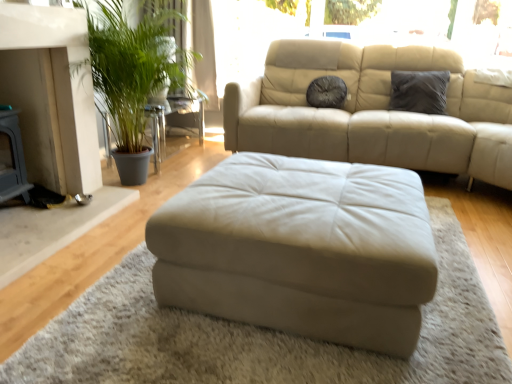
This screenshot has width=512, height=384. What do you see at coordinates (419, 91) in the screenshot? I see `dark gray fabric pillow at upper right, the first pillow from the right` at bounding box center [419, 91].

Identify the location of beige leather ottoman at center. (300, 249).

Which of these two, dark gray fabric pillow at upper right, the first pillow from the right, or dark gray textured pillow at center, the 2th pillow when ordered from right to left, is thinner?

Thinner between the two is dark gray fabric pillow at upper right, the first pillow from the right.

Is dark gray fabric pillow at upper right, the first pillow from the right, placed right next to dark gray textured pillow at center, the first pillow positioned from the left?

No, dark gray fabric pillow at upper right, the first pillow from the right, is not making contact with dark gray textured pillow at center, the first pillow positioned from the left.

Which is in front, dark gray fabric pillow at upper right, the first pillow from the right, or dark gray textured pillow at center, the first pillow positioned from the left?

dark gray fabric pillow at upper right, the first pillow from the right, is more forward.

Is dark gray fabric pillow at upper right, which is counted as the second pillow, starting from the left, at the left side of dark gray textured pillow at center, the first pillow positioned from the left?

Incorrect, dark gray fabric pillow at upper right, which is counted as the second pillow, starting from the left, is not on the left side of dark gray textured pillow at center, the first pillow positioned from the left.

Is green leafy plant at left oriented towards dark gray fabric pillow at upper right, the first pillow from the right?

Yes.

Is green leafy plant at left next to dark gray fabric pillow at upper right, the first pillow from the right, and touching it?

green leafy plant at left and dark gray fabric pillow at upper right, the first pillow from the right, are clearly separated.

Relative to dark gray fabric pillow at upper right, the first pillow from the right, is green leafy plant at left in front or behind?

green leafy plant at left is behind dark gray fabric pillow at upper right, the first pillow from the right.

From the image's perspective, is dark gray textured pillow at center, the 2th pillow when ordered from right to left, located above or below dark gray fabric pillow at upper right, which is counted as the second pillow, starting from the left?

From the image's perspective, dark gray textured pillow at center, the 2th pillow when ordered from right to left, appears above dark gray fabric pillow at upper right, which is counted as the second pillow, starting from the left.

Does dark gray textured pillow at center, the 2th pillow when ordered from right to left, lie in front of dark gray fabric pillow at upper right, the first pillow from the right?

No, it is behind dark gray fabric pillow at upper right, the first pillow from the right.

Is dark gray textured pillow at center, the 2th pillow when ordered from right to left, situated inside dark gray fabric pillow at upper right, which is counted as the second pillow, starting from the left, or outside?

dark gray textured pillow at center, the 2th pillow when ordered from right to left, is not enclosed by dark gray fabric pillow at upper right, which is counted as the second pillow, starting from the left.

Locate an element on the screen. This screenshot has height=384, width=512. pillow on the left of dark gray fabric pillow at upper right, the first pillow from the right is located at coordinates (326, 92).

Does dark gray textured pillow at center, the first pillow positioned from the left, contain beige leather ottoman at center?

No, beige leather ottoman at center is not a part of dark gray textured pillow at center, the first pillow positioned from the left.

From the image's perspective, is dark gray textured pillow at center, the 2th pillow when ordered from right to left, above or below beige leather ottoman at center?

Clearly, from the image's perspective, dark gray textured pillow at center, the 2th pillow when ordered from right to left, is above beige leather ottoman at center.

Who is smaller, dark gray textured pillow at center, the 2th pillow when ordered from right to left, or beige leather ottoman at center?

dark gray textured pillow at center, the 2th pillow when ordered from right to left.

Is dark gray textured pillow at center, the 2th pillow when ordered from right to left, positioned with its back to beige leather ottoman at center?

No, dark gray textured pillow at center, the 2th pillow when ordered from right to left,'s orientation is not away from beige leather ottoman at center.

Does green leafy plant at left come behind beige fabric ottoman at center?

Yes, it is behind beige fabric ottoman at center.

Consider the image. How many degrees apart are the facing directions of green leafy plant at left and beige fabric ottoman at center?

91.3 degrees separate the facing orientations of green leafy plant at left and beige fabric ottoman at center.

Considering the sizes of objects green leafy plant at left and beige fabric ottoman at center in the image provided, who is smaller, green leafy plant at left or beige fabric ottoman at center?

beige fabric ottoman at center.

From the image's perspective, which is below, green leafy plant at left or beige fabric ottoman at center?

beige fabric ottoman at center, from the image's perspective.

You are a GUI agent. You are given a task and a screenshot of the screen. Output one action in this format:
    pyautogui.click(x=<x>, y=<y>)
    Task: Click on the table that is above the beige leather ottoman at center (from the image's perspective)
    This screenshot has height=384, width=512.
    Given the screenshot: What is the action you would take?
    pyautogui.click(x=172, y=123)

Is green leafy plant at left with beige leather ottoman at center?

No.

Is beige leather ottoman at center at the back of green leafy plant at left?

No, green leafy plant at left is not facing the opposite direction of beige leather ottoman at center.

Considering the sizes of dark gray fabric pillow at upper right, the first pillow from the right, and beige fabric ottoman at center in the image, is dark gray fabric pillow at upper right, the first pillow from the right, wider or thinner than beige fabric ottoman at center?

Considering their sizes, dark gray fabric pillow at upper right, the first pillow from the right, looks slimmer than beige fabric ottoman at center.

From the image's perspective, which object appears higher, dark gray fabric pillow at upper right, the first pillow from the right, or beige fabric ottoman at center?

dark gray fabric pillow at upper right, the first pillow from the right, from the image's perspective.

Is beige fabric ottoman at center a part of dark gray fabric pillow at upper right, which is counted as the second pillow, starting from the left?

Definitely not — beige fabric ottoman at center is not inside dark gray fabric pillow at upper right, which is counted as the second pillow, starting from the left.

I want to click on mat in front of the dark gray fabric pillow at upper right, which is counted as the second pillow, starting from the left, so click(x=259, y=336).

You are a GUI agent. You are given a task and a screenshot of the screen. Output one action in this format:
    pyautogui.click(x=<x>, y=<y>)
    Task: Click on the pillow that is below the dark gray textured pillow at center, the first pillow positioned from the left (from the image's perspective)
    The image size is (512, 384).
    Given the screenshot: What is the action you would take?
    (419, 91)

Find the location of a particular element. table located on the left of dark gray fabric pillow at upper right, the first pillow from the right is located at coordinates (172, 123).

Which object lies nearer to the anchor point dark gray fabric pillow at upper right, the first pillow from the right, beige leather ottoman at center or dark gray textured pillow at center, the 2th pillow when ordered from right to left?

Based on the image, dark gray textured pillow at center, the 2th pillow when ordered from right to left, appears to be nearer to dark gray fabric pillow at upper right, the first pillow from the right.

In the scene shown: Considering their positions, is beige fabric ottoman at center positioned closer to dark gray fabric pillow at upper right, which is counted as the second pillow, starting from the left, than dark gray textured pillow at center, the 2th pillow when ordered from right to left?

dark gray textured pillow at center, the 2th pillow when ordered from right to left.

When comparing their distances from dark gray fabric pillow at upper right, the first pillow from the right, does green leafy plant at left or beige leather ottoman at center seem closer?

green leafy plant at left.

Which object lies nearer to the anchor point green leafy plant at left, beige leather ottoman at center or beige fabric ottoman at center?

beige leather ottoman at center.

Based on their spatial positions, is dark gray fabric pillow at upper right, which is counted as the second pillow, starting from the left, or beige fabric ottoman at center closer to dark gray textured pillow at center, the first pillow positioned from the left?

dark gray fabric pillow at upper right, which is counted as the second pillow, starting from the left, is positioned closer to the anchor dark gray textured pillow at center, the first pillow positioned from the left.

Looking at the image, which one is located closer to dark gray fabric pillow at upper right, which is counted as the second pillow, starting from the left, dark gray textured pillow at center, the first pillow positioned from the left, or beige leather ottoman at center?

The object closer to dark gray fabric pillow at upper right, which is counted as the second pillow, starting from the left, is dark gray textured pillow at center, the first pillow positioned from the left.

Estimate the real-world distances between objects in this image. Which object is further from beige fabric ottoman at center, beige leather ottoman at center or green leafy plant at left?

The object further to beige fabric ottoman at center is green leafy plant at left.

Which object lies further to the anchor point beige fabric ottoman at center, dark gray textured pillow at center, the 2th pillow when ordered from right to left, or dark gray fabric pillow at upper right, the first pillow from the right?

The object further to beige fabric ottoman at center is dark gray textured pillow at center, the 2th pillow when ordered from right to left.

The width and height of the screenshot is (512, 384). Identify the location of table positioned between beige fabric ottoman at center and dark gray textured pillow at center, the first pillow positioned from the left, from near to far. (172, 123).

The width and height of the screenshot is (512, 384). I want to click on pillow between beige leather ottoman at center and green leafy plant at left in the front-back direction, so click(419, 91).

Where is `studio couch located between beige fabric ottoman at center and green leafy plant at left in the depth direction`? The height and width of the screenshot is (384, 512). studio couch located between beige fabric ottoman at center and green leafy plant at left in the depth direction is located at coordinates (300, 249).

Find the location of a particular element. Image resolution: width=512 pixels, height=384 pixels. pillow between green leafy plant at left and dark gray fabric pillow at upper right, the first pillow from the right is located at coordinates (326, 92).